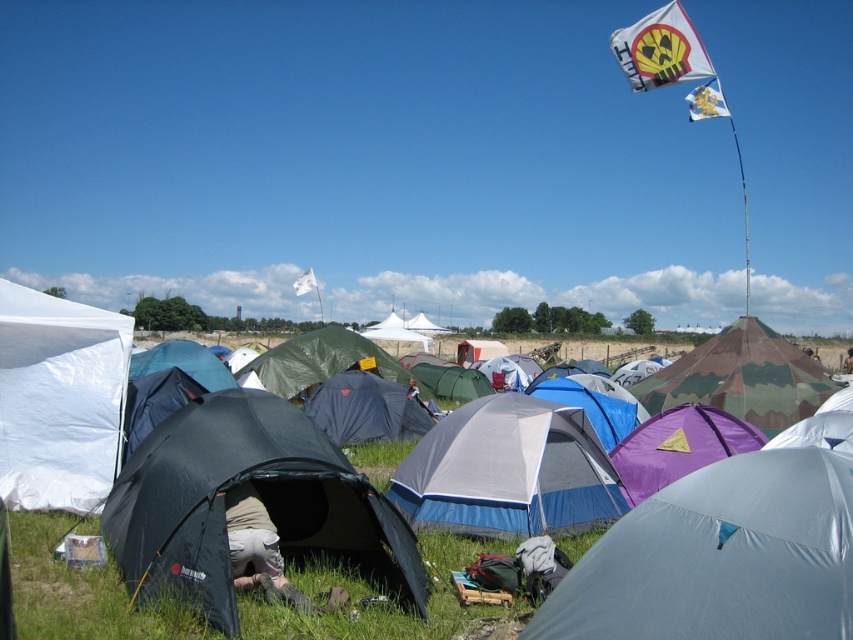
Who is higher up, black fabric tent at center or white/blue fabric tent at center?

black fabric tent at center is above.

Who is positioned more to the right, black fabric tent at center or white/blue fabric tent at center?

white/blue fabric tent at center is more to the right.

Which is behind, point (262, 477) or point (514, 513)?

Point (514, 513)

Locate an element on the screen. black fabric tent at center is located at coordinates (258, 496).

Is black fabric tent at center taller than dark blue tarp at center?

Yes, black fabric tent at center is taller than dark blue tarp at center.

Who is lower down, black fabric tent at center or dark blue tarp at center?

dark blue tarp at center is below.

Locate an element on the screen. The image size is (853, 640). black fabric tent at center is located at coordinates (258, 496).

Identify the location of black fabric tent at center. The image size is (853, 640). (258, 496).

Is white matte tent at left shorter than khaki fabric pants at center?

In fact, white matte tent at left may be taller than khaki fabric pants at center.

Does white matte tent at left appear on the left side of khaki fabric pants at center?

Indeed, white matte tent at left is positioned on the left side of khaki fabric pants at center.

This screenshot has height=640, width=853. I want to click on white matte tent at left, so click(59, 400).